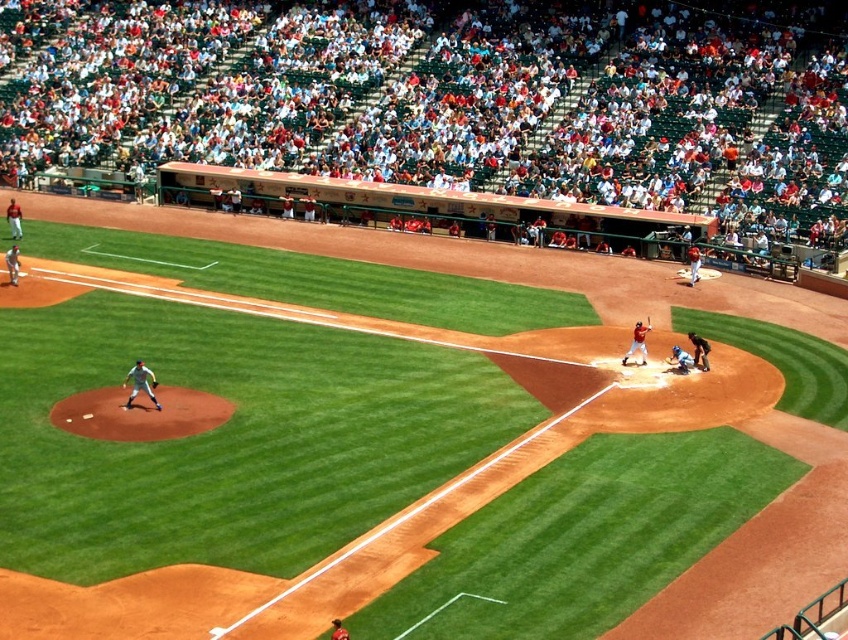
Which is more to the right, white matte baseball glove at center or brown leather glove at center?

brown leather glove at center is more to the right.

Which of these two, white matte baseball glove at center or brown leather glove at center, stands shorter?

Standing shorter between the two is brown leather glove at center.

Between point (143, 381) and point (152, 385), which one is positioned in front?

Point (143, 381) is in front.

The width and height of the screenshot is (848, 640). I want to click on white matte baseball glove at center, so click(140, 384).

Looking at this image, does blue matte catcher at home plate appear under brown leather glove at center?

No, blue matte catcher at home plate is not below brown leather glove at center.

Between point (679, 362) and point (155, 384), which one is positioned in front?

Positioned in front is point (155, 384).

Image resolution: width=848 pixels, height=640 pixels. Identify the location of blue matte catcher at home plate. (679, 358).

Which is behind, point (759, 241) or point (650, 324)?

The point (759, 241) is more distant.

Is white fabric crowd at upper center wider than shiny black bat at home plate?

Correct, the width of white fabric crowd at upper center exceeds that of shiny black bat at home plate.

This screenshot has width=848, height=640. In order to click on white fabric crowd at upper center in this screenshot , I will do `click(466, 108)`.